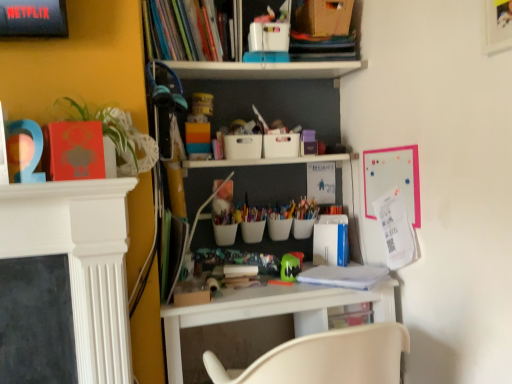
Question: In which direction should I rotate to look at hardcover books at upper center, which is the 1th book from top to bottom?

Choices:
 (A) left
 (B) right

Answer: (A)

Question: Is white plastic desk at center thinner than green leafy plant at left?

Choices:
 (A) no
 (B) yes

Answer: (A)

Question: Would you say green leafy plant at left is part of white plastic desk at center's contents?

Choices:
 (A) no
 (B) yes

Answer: (A)

Question: Considering the relative sizes of white plastic desk at center and green leafy plant at left in the image provided, is white plastic desk at center wider than green leafy plant at left?

Choices:
 (A) yes
 (B) no

Answer: (A)

Question: Is white plastic desk at center next to green leafy plant at left?

Choices:
 (A) no
 (B) yes

Answer: (A)

Question: Does white plastic desk at center have a greater height compared to green leafy plant at left?

Choices:
 (A) yes
 (B) no

Answer: (A)

Question: From the image's perspective, is white plastic desk at center on top of green leafy plant at left?

Choices:
 (A) yes
 (B) no

Answer: (B)

Question: Is green leafy plant at left inside green rubber toy at center?

Choices:
 (A) no
 (B) yes

Answer: (A)

Question: Is green rubber toy at center to the left of green leafy plant at left from the viewer's perspective?

Choices:
 (A) yes
 (B) no

Answer: (B)

Question: Is green rubber toy at center turned away from green leafy plant at left?

Choices:
 (A) yes
 (B) no

Answer: (B)

Question: From the image's perspective, is green rubber toy at center located above green leafy plant at left?

Choices:
 (A) yes
 (B) no

Answer: (B)

Question: Is green rubber toy at center placed right next to green leafy plant at left?

Choices:
 (A) yes
 (B) no

Answer: (B)

Question: Is the position of green rubber toy at center more distant than that of green leafy plant at left?

Choices:
 (A) no
 (B) yes

Answer: (B)

Question: Is hardcover books at upper center, which ranks as the second book in bottom-to-top order, bigger than white plastic desk at center?

Choices:
 (A) no
 (B) yes

Answer: (A)